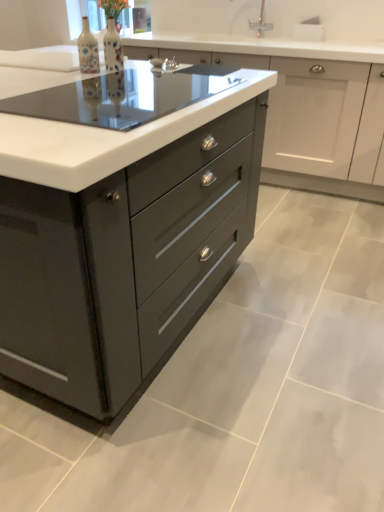
This screenshot has width=384, height=512. Find the location of `free space to the left of matte ceramic bottle at upper left, the first bottle viewed from the left`. free space to the left of matte ceramic bottle at upper left, the first bottle viewed from the left is located at coordinates (47, 71).